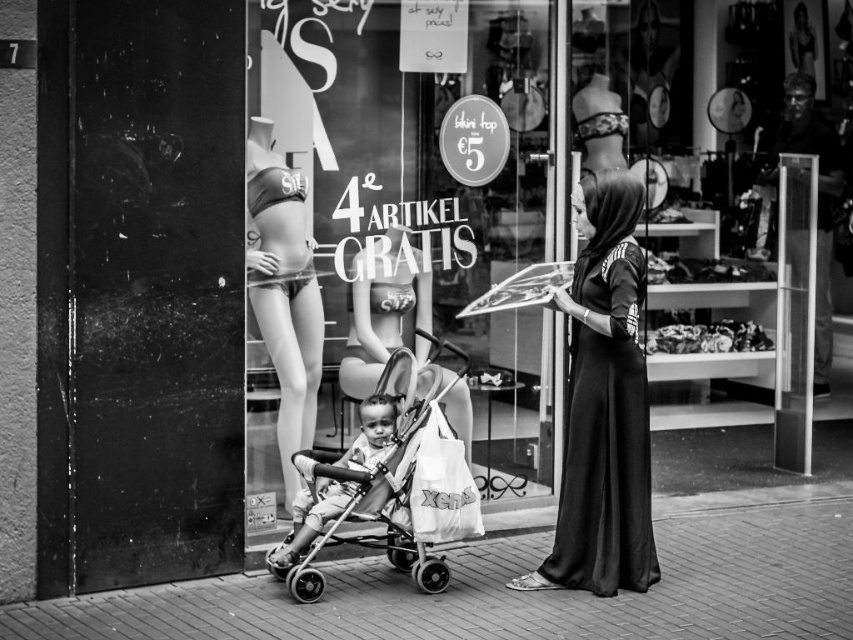
Question: Does metallic stroller at center come behind smooth skin mannequin at center?

Choices:
 (A) no
 (B) yes

Answer: (A)

Question: Can you confirm if metallic stroller at center is wider than matte black dress at center?

Choices:
 (A) no
 (B) yes

Answer: (B)

Question: Considering the real-world distances, which object is farthest from the smooth skin baby at center?

Choices:
 (A) transparent glass at center
 (B) black silk abaya at center

Answer: (B)

Question: Does black silk abaya at center lie in front of metallic stroller at center?

Choices:
 (A) no
 (B) yes

Answer: (A)

Question: Which point is closer to the camera?

Choices:
 (A) (399, 536)
 (B) (645, 556)
 (C) (422, 289)

Answer: (B)

Question: Estimate the real-world distances between objects in this image. Which object is farther from the smooth skin mannequin at center?

Choices:
 (A) transparent glass at center
 (B) black silk abaya at center
 (C) matte black dress at center

Answer: (B)